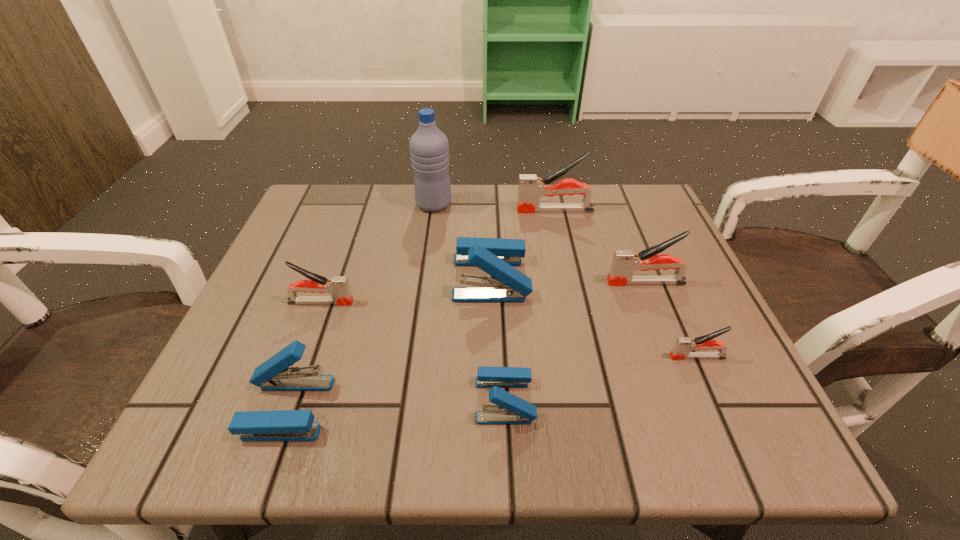
Where is `unoccupied area between the third nearest gray stapler and the farthest gray stapler`? The image size is (960, 540). unoccupied area between the third nearest gray stapler and the farthest gray stapler is located at coordinates (600, 246).

You are a GUI agent. You are given a task and a screenshot of the screen. Output one action in this format:
    pyautogui.click(x=<x>, y=<y>)
    Task: Click on the empty space that is in between the second biggest blue stapler and the second smallest gray stapler
    The width and height of the screenshot is (960, 540).
    Given the screenshot: What is the action you would take?
    pyautogui.click(x=304, y=355)

Locate an element on the screen. This screenshot has width=960, height=540. empty space that is in between the second farthest gray stapler and the biggest gray stapler is located at coordinates (600, 246).

The width and height of the screenshot is (960, 540). In order to click on unoccupied position between the tallest object and the farthest stapler in this screenshot , I will do `click(494, 207)`.

Identify the location of free space between the farthest blue stapler and the smallest blue stapler. Image resolution: width=960 pixels, height=540 pixels. (498, 339).

Identify which object is the third nearest to the second nearest gray stapler. Please provide its 2D coordinates. Your answer should be formatted as a tuple, i.e. [(x, y)], where the tuple contains the x and y coordinates of a point satisfying the conditions above.

[(509, 409)]

The height and width of the screenshot is (540, 960). In order to click on object that stands as the seventh closest to the leftmost blue stapler in this screenshot , I will do `click(531, 188)`.

Identify which stapler is the second nearest to the tallest stapler. Please provide its 2D coordinates. Your answer should be formatted as a tuple, i.e. [(x, y)], where the tuple contains the x and y coordinates of a point satisfying the conditions above.

[(625, 262)]

Locate an element on the screen. stapler that is the second closest to the third smallest gray stapler is located at coordinates (683, 345).

The width and height of the screenshot is (960, 540). Find the location of `gray stapler that stands as the third closest to the second smallest blue stapler`. gray stapler that stands as the third closest to the second smallest blue stapler is located at coordinates (683, 345).